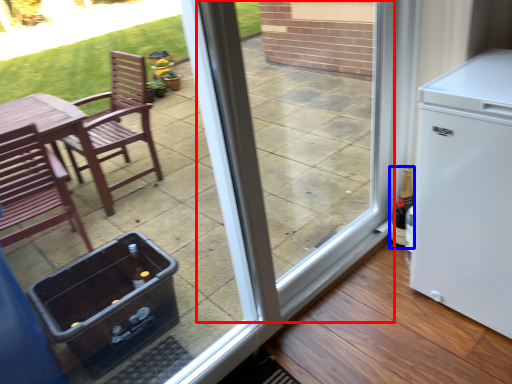
Question: Which point is further to the camera, screen door (highlighted by a red box) or bottle (highlighted by a blue box)?

Choices:
 (A) screen door
 (B) bottle

Answer: (B)